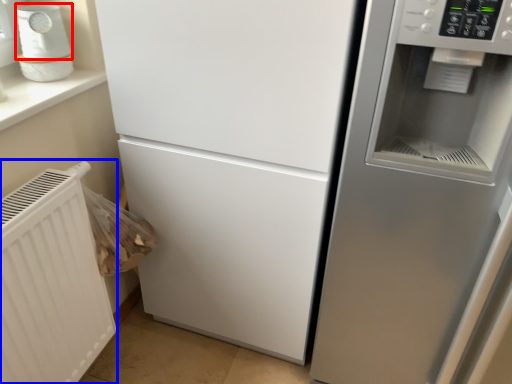
Question: Which of the following is the farthest to the observer, appliance (highlighted by a red box) or radiator (highlighted by a blue box)?

Choices:
 (A) appliance
 (B) radiator

Answer: (A)